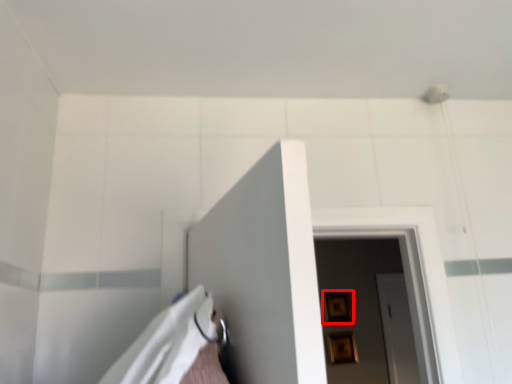
Question: From the image, what is the correct spatial relationship of picture frame (annotated by the red box) in relation to picture frame?

Choices:
 (A) right
 (B) left

Answer: (B)